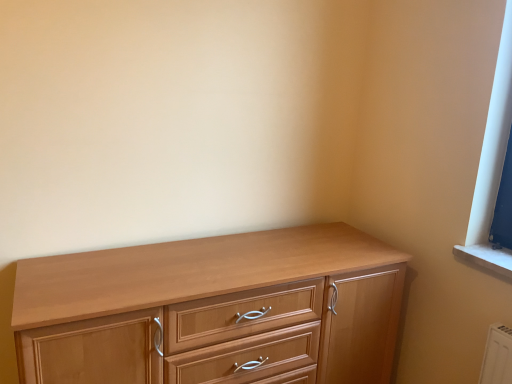
What do you see at coordinates (214, 311) in the screenshot? The height and width of the screenshot is (384, 512). I see `light brown wood chest of drawers at lower left` at bounding box center [214, 311].

At what (x,y) coordinates should I click in order to perform the action: click on light brown wood chest of drawers at lower left. Please return your answer as a coordinate pair (x, y). The width and height of the screenshot is (512, 384). Looking at the image, I should click on (214, 311).

In order to face light brown wood chest of drawers at lower left, should I rotate leftwards or rightwards?

To face it directly, rotate left by 3.220 degrees.

This screenshot has width=512, height=384. What are the coordinates of `light brown wood chest of drawers at lower left` in the screenshot? It's located at (214, 311).